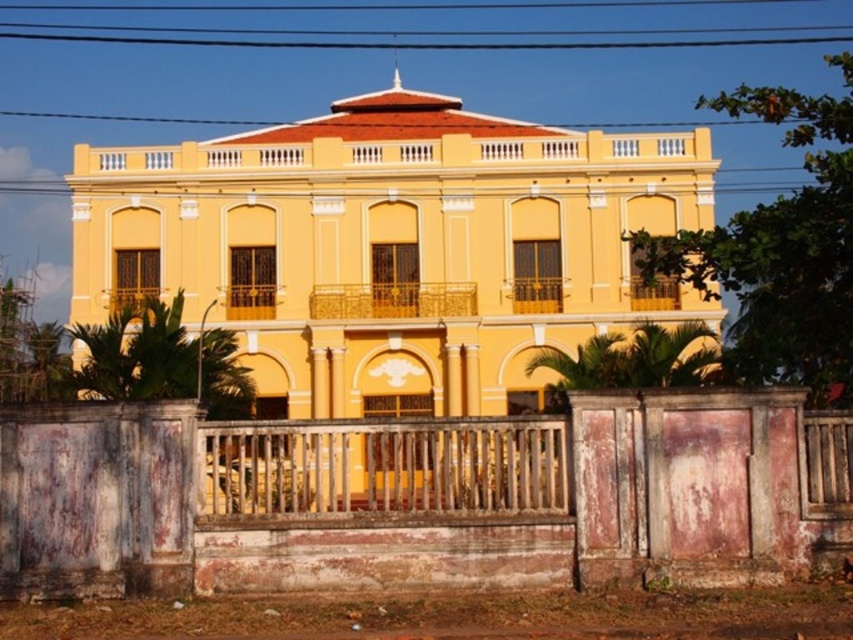
Is rusty wooden fence at center smaller than wooden at center?

No, rusty wooden fence at center is not smaller than wooden at center.

At what (x,y) coordinates should I click in order to perform the action: click on rusty wooden fence at center. Please return your answer as a coordinate pair (x, y). Looking at the image, I should click on (428, 499).

The height and width of the screenshot is (640, 853). I want to click on rusty wooden fence at center, so click(x=428, y=499).

The image size is (853, 640). Describe the element at coordinates (386, 467) in the screenshot. I see `wooden at center` at that location.

Between wooden at center and black wire at upper center, which one is positioned higher?

black wire at upper center

What do you see at coordinates (386, 467) in the screenshot? I see `wooden at center` at bounding box center [386, 467].

Where is `wooden at center`? This screenshot has width=853, height=640. wooden at center is located at coordinates (386, 467).

Between rusty wooden fence at center and black wire at upper center, which one appears on the left side from the viewer's perspective?

Positioned to the left is rusty wooden fence at center.

Is rusty wooden fence at center to the left of black wire at upper center from the viewer's perspective?

Yes, rusty wooden fence at center is to the left of black wire at upper center.

Is point (380, 580) closer to camera compared to point (161, 36)?

That is True.

You are a GUI agent. You are given a task and a screenshot of the screen. Output one action in this format:
    pyautogui.click(x=<x>, y=<y>)
    Task: Click on the rusty wooden fence at center
    
    Given the screenshot: What is the action you would take?
    pyautogui.click(x=428, y=499)